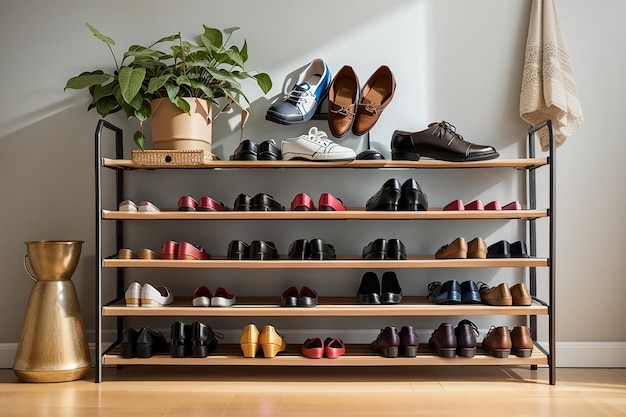
The height and width of the screenshot is (417, 626). Find the location of `shoes on topmost shelf`. shoes on topmost shelf is located at coordinates (245, 146), (265, 148), (309, 145), (431, 141), (305, 102), (341, 112), (366, 113).